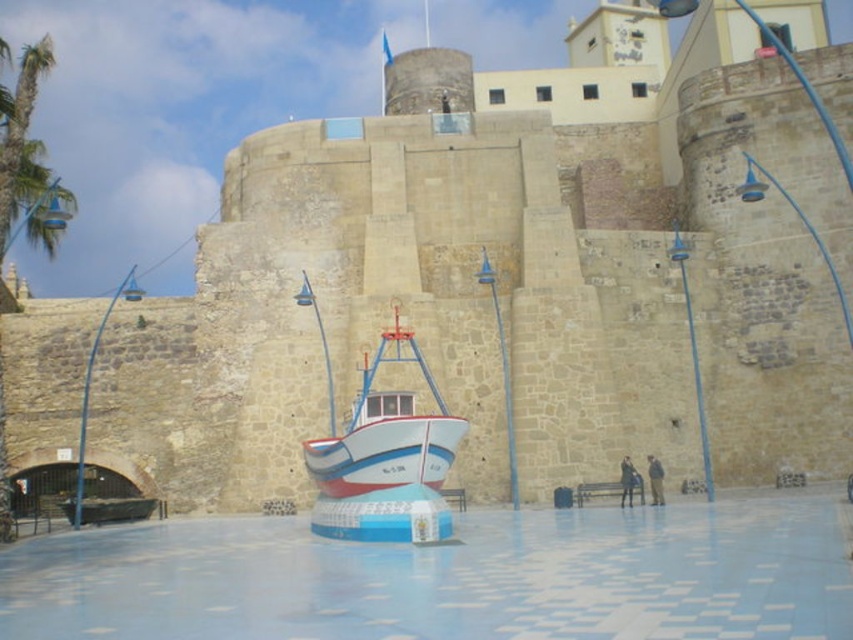
You are a visitor at the fortress and want to take a photo of the white glossy boat at center without the green leafy palm tree at upper left appearing in the background. Is the palm tree taller than the boat?

The white glossy boat at center is not as tall as green leafy palm tree at upper left, so the palm tree is taller. To avoid it in your photo, position yourself so the tree is out of the frame or use a lower angle to block its view.

You are planning to place a new statue exactly between the white glossy boat at center and the green leafy palm tree at upper left. Given their widths, which object will require more space horizontally for the statue to fit comfortably?

The green leafy palm tree at upper left requires more horizontal space because its width is greater than the white glossy boat at center.

You are standing at the entrance of the fortress and want to place a new decorative flagpole exactly at the center of the fortress. The current white glossy boat at center is in the way. Based on its coordinates, can you determine whether the boat is blocking the center of the fortress?

The white glossy boat at center is positioned at coordinates point (381,428), which is not at the exact center of the fortress. Therefore, the boat is not blocking the center of the fortress.